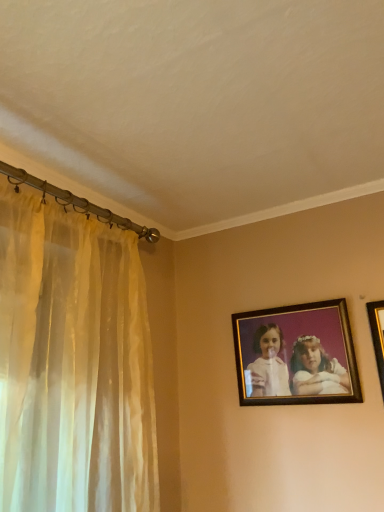
Image resolution: width=384 pixels, height=512 pixels. Describe the element at coordinates (377, 336) in the screenshot. I see `gold-framed picture at upper right, the 2th picture frame from the left` at that location.

Identify the location of gold-framed picture at upper right, which is counted as the first picture frame, starting from the right. (377, 336).

Describe the element at coordinates (296, 354) in the screenshot. The image size is (384, 512). I see `wooden frame at upper right, the 1th picture frame viewed from the left` at that location.

Locate an element on the screen. Image resolution: width=384 pixels, height=512 pixels. wooden frame at upper right, the 1th picture frame viewed from the left is located at coordinates (296, 354).

I want to click on gold-framed picture at upper right, which is counted as the first picture frame, starting from the right, so click(x=377, y=336).

Between gold-framed picture at upper right, the 2th picture frame from the left, and wooden frame at upper right, the 1th picture frame positioned from the back, which one appears on the left side from the viewer's perspective?

wooden frame at upper right, the 1th picture frame positioned from the back, is more to the left.

Between gold-framed picture at upper right, which is counted as the first picture frame, starting from the right, and wooden frame at upper right, which is counted as the second picture frame, starting from the front, which one is positioned in front?

gold-framed picture at upper right, which is counted as the first picture frame, starting from the right, is more forward.

Considering the positions of points (370, 317) and (257, 330), is point (370, 317) farther from camera compared to point (257, 330)?

No, it is not.

From the image's perspective, between gold-framed picture at upper right, positioned as the 2th picture frame in back-to-front order, and wooden frame at upper right, the 2th picture frame viewed from the right, which one is located above?

gold-framed picture at upper right, positioned as the 2th picture frame in back-to-front order.

From a real-world perspective, is gold-framed picture at upper right, positioned as the 2th picture frame in back-to-front order, on top of wooden frame at upper right, the 1th picture frame viewed from the left?

No.

Which object is thinner, gold-framed picture at upper right, the 1th picture frame when ordered from front to back, or wooden frame at upper right, the 1th picture frame viewed from the left?

gold-framed picture at upper right, the 1th picture frame when ordered from front to back.

Is gold-framed picture at upper right, the 1th picture frame when ordered from front to back, taller than wooden frame at upper right, the 2th picture frame viewed from the right?

Yes.

Between gold-framed picture at upper right, the 2th picture frame from the left, and wooden frame at upper right, the 1th picture frame positioned from the back, which one has larger size?

Bigger between the two is wooden frame at upper right, the 1th picture frame positioned from the back.

Do you think gold-framed picture at upper right, the 2th picture frame from the left, is within wooden frame at upper right, the 1th picture frame positioned from the back, or outside of it?

gold-framed picture at upper right, the 2th picture frame from the left, is spatially situated outside wooden frame at upper right, the 1th picture frame positioned from the back.

Looking at this image, are gold-framed picture at upper right, positioned as the 2th picture frame in back-to-front order, and wooden frame at upper right, the 2th picture frame viewed from the right, far apart?

No, there isn't a large distance between gold-framed picture at upper right, positioned as the 2th picture frame in back-to-front order, and wooden frame at upper right, the 2th picture frame viewed from the right.

Does gold-framed picture at upper right, the 2th picture frame from the left, turn towards wooden frame at upper right, which is counted as the second picture frame, starting from the front?

No, gold-framed picture at upper right, the 2th picture frame from the left, is not aimed at wooden frame at upper right, which is counted as the second picture frame, starting from the front.

What's the angular difference between gold-framed picture at upper right, the 1th picture frame when ordered from front to back, and wooden frame at upper right, the 2th picture frame viewed from the right,'s facing directions?

The angle between the facing direction of gold-framed picture at upper right, the 1th picture frame when ordered from front to back, and the facing direction of wooden frame at upper right, the 2th picture frame viewed from the right, is 0.00117 degrees.

In order to click on picture frame located above the wooden frame at upper right, which is counted as the second picture frame, starting from the front (from the image's perspective) in this screenshot , I will do point(377,336).

Based on the photo, between wooden frame at upper right, which is counted as the second picture frame, starting from the front, and gold-framed picture at upper right, the 2th picture frame from the left, which one appears on the right side from the viewer's perspective?

From the viewer's perspective, gold-framed picture at upper right, the 2th picture frame from the left, appears more on the right side.

Which object is further away from the camera taking this photo, wooden frame at upper right, which is counted as the second picture frame, starting from the front, or gold-framed picture at upper right, which is counted as the first picture frame, starting from the right?

wooden frame at upper right, which is counted as the second picture frame, starting from the front.

Does point (303, 371) come farther from viewer compared to point (376, 349)?

Yes, it is.

From the image's perspective, is wooden frame at upper right, the 2th picture frame viewed from the right, above gold-framed picture at upper right, which is counted as the first picture frame, starting from the right?

No, from the image's perspective, wooden frame at upper right, the 2th picture frame viewed from the right, is not over gold-framed picture at upper right, which is counted as the first picture frame, starting from the right.

From a real-world perspective, which object stands above the other?

From a 3D spatial view, wooden frame at upper right, the 1th picture frame positioned from the back, is above.

Does wooden frame at upper right, which is counted as the second picture frame, starting from the front, have a lesser width compared to gold-framed picture at upper right, the 1th picture frame when ordered from front to back?

In fact, wooden frame at upper right, which is counted as the second picture frame, starting from the front, might be wider than gold-framed picture at upper right, the 1th picture frame when ordered from front to back.

In the scene shown: Does wooden frame at upper right, which is counted as the second picture frame, starting from the front, have a lesser height compared to gold-framed picture at upper right, the 2th picture frame from the left?

Yes.

Who is bigger, wooden frame at upper right, the 2th picture frame viewed from the right, or gold-framed picture at upper right, the 1th picture frame when ordered from front to back?

Bigger between the two is wooden frame at upper right, the 2th picture frame viewed from the right.

Could gold-framed picture at upper right, the 2th picture frame from the left, be considered to be inside wooden frame at upper right, the 1th picture frame positioned from the back?

No, gold-framed picture at upper right, the 2th picture frame from the left, is not surrounded by wooden frame at upper right, the 1th picture frame positioned from the back.

Can you see wooden frame at upper right, the 2th picture frame viewed from the right, touching gold-framed picture at upper right, which is counted as the first picture frame, starting from the right?

No, wooden frame at upper right, the 2th picture frame viewed from the right, is not beside gold-framed picture at upper right, which is counted as the first picture frame, starting from the right.

Does wooden frame at upper right, the 1th picture frame viewed from the left, turn towards gold-framed picture at upper right, which is counted as the first picture frame, starting from the right?

No.

Could you measure the distance between wooden frame at upper right, which is counted as the second picture frame, starting from the front, and gold-framed picture at upper right, which is counted as the first picture frame, starting from the right?

The distance of wooden frame at upper right, which is counted as the second picture frame, starting from the front, from gold-framed picture at upper right, which is counted as the first picture frame, starting from the right, is 25.23 centimeters.

Find the location of a particular element. The height and width of the screenshot is (512, 384). picture frame above the wooden frame at upper right, the 1th picture frame positioned from the back (from the image's perspective) is located at coordinates (377, 336).

Identify the location of picture frame that is on the left side of gold-framed picture at upper right, which is counted as the first picture frame, starting from the right. (296, 354).

Find the location of a particular element. picture frame above the wooden frame at upper right, the 1th picture frame viewed from the left (from the image's perspective) is located at coordinates (377, 336).